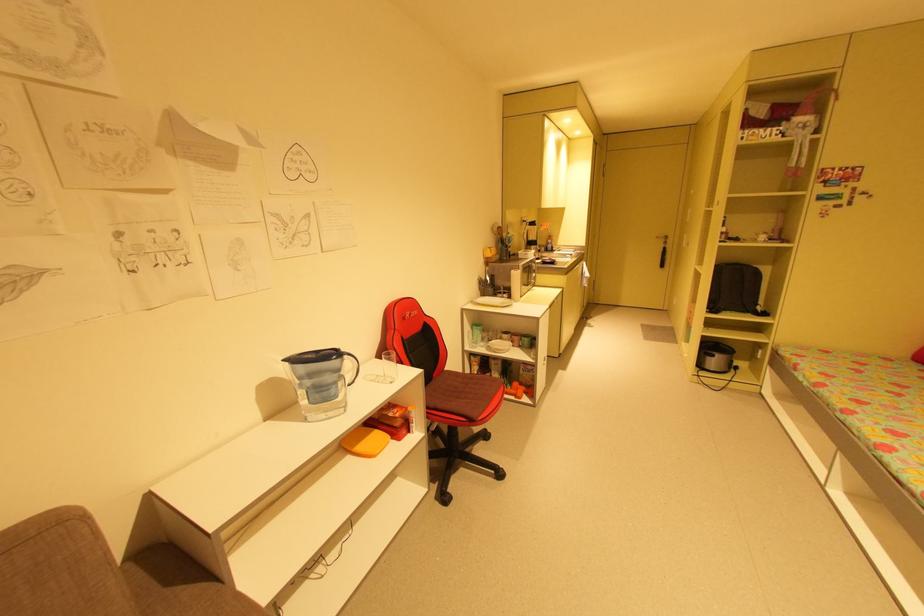
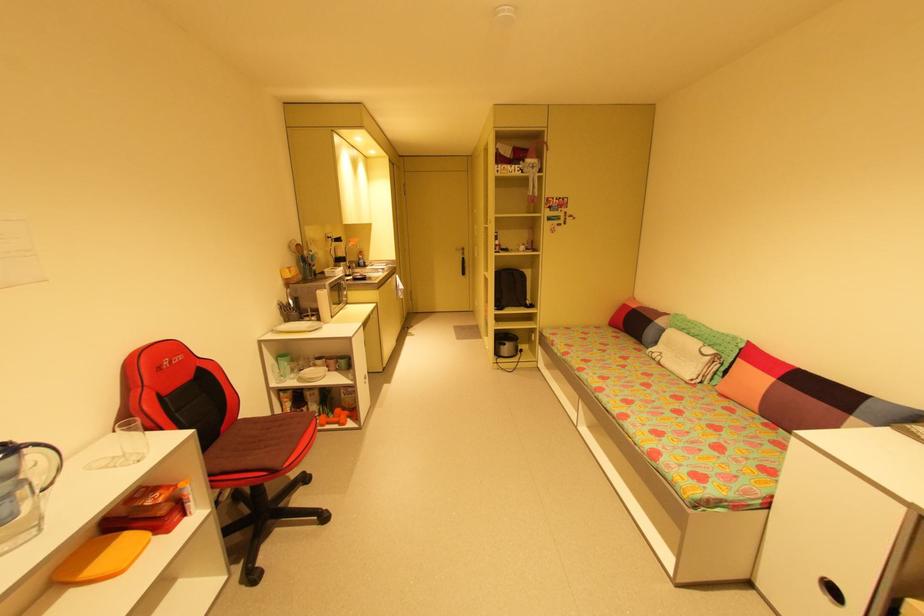
Where in the second image is the point corresponding to point 502,339 from the first image?

(313, 367)